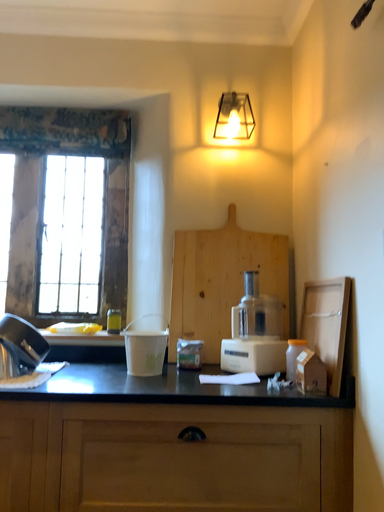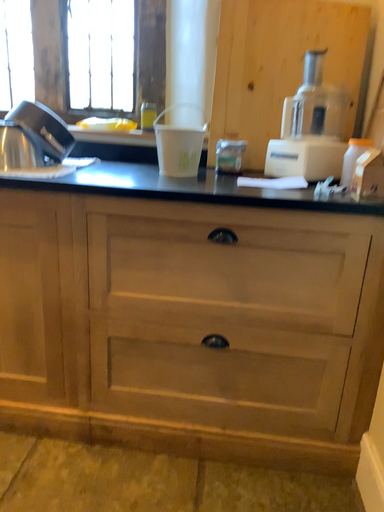
Question: How did the camera likely rotate when shooting the video?

Choices:
 (A) rotated right
 (B) rotated left

Answer: (B)